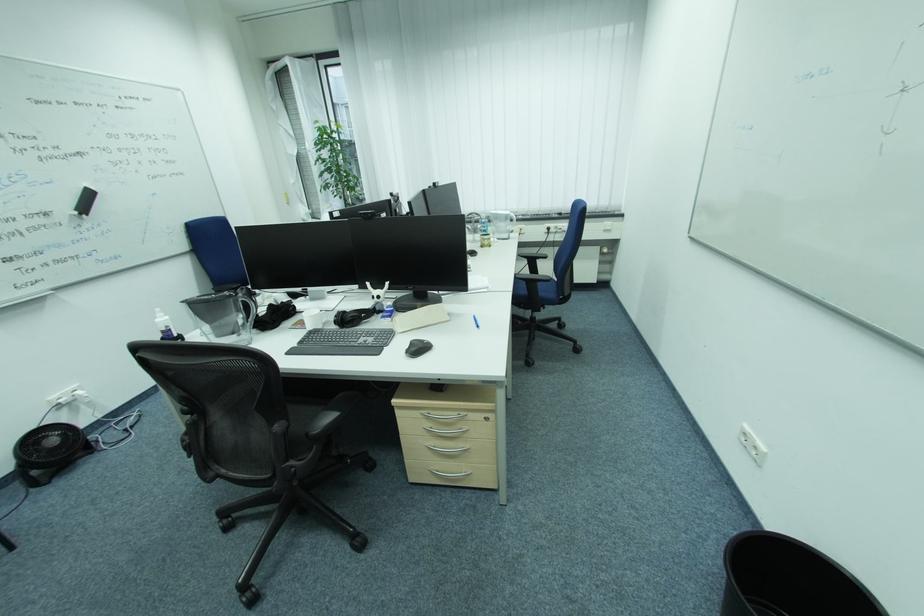
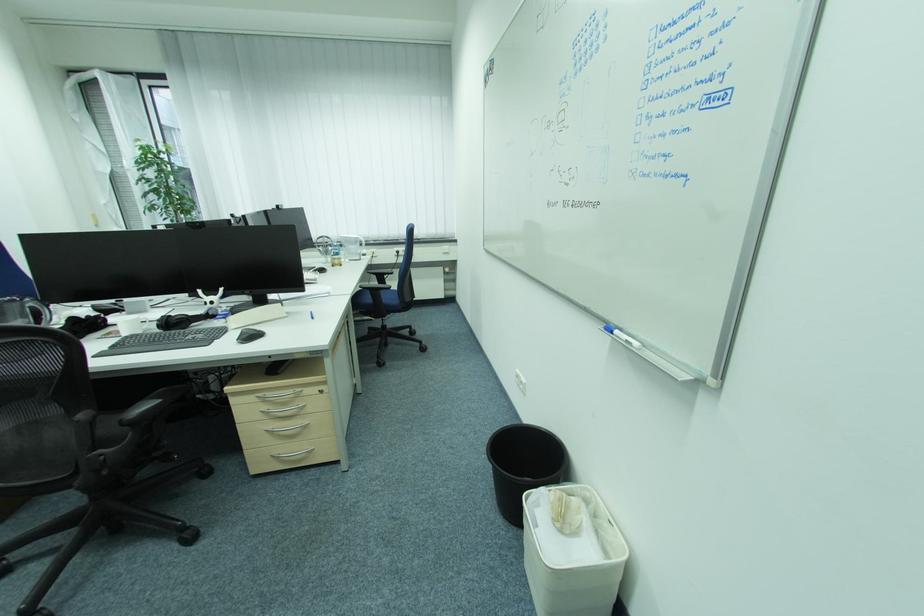
In the second image, find the point that corresponds to the point at 419,350 in the first image.

(251, 338)